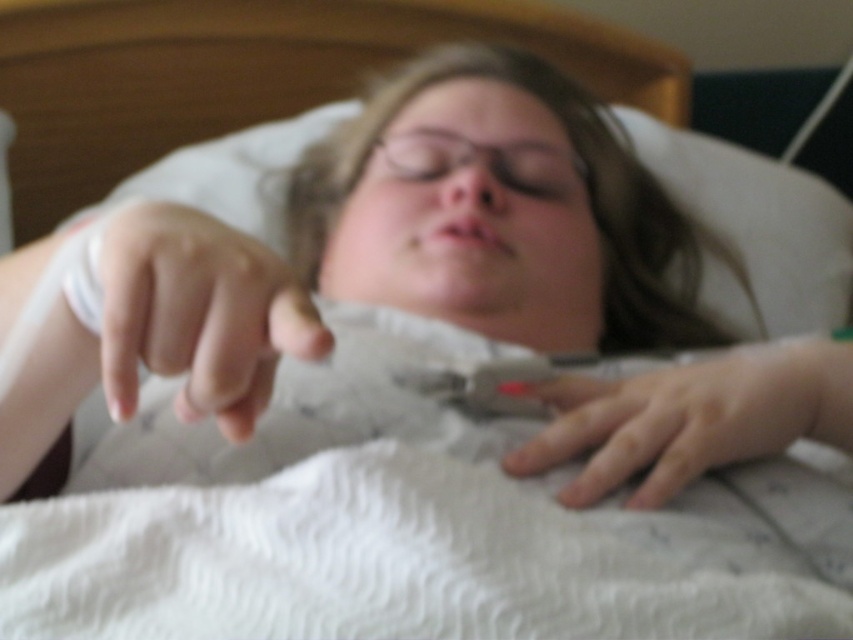
You are a nurse checking the patient in the hospital bed. You notice the smooth skin finger at center and the smooth skin hand at lower center. Which part of the patient has a smaller size?

The smooth skin finger at center has a smaller size compared to the smooth skin hand at lower center.

You are a healthcare worker checking on a patient in the hospital. You notice the smooth skin finger at center and the smooth skin hand at lower center. Which of these two body parts is closer to you?

The smooth skin finger at center is closer to the viewer than the smooth skin hand at lower center.

You are a nurse checking on a patient in the hospital. You notice the smooth skin finger at center and the smooth skin hand at lower center. Which one is taller in the image?

The smooth skin finger at center is much taller than the smooth skin hand at lower center.